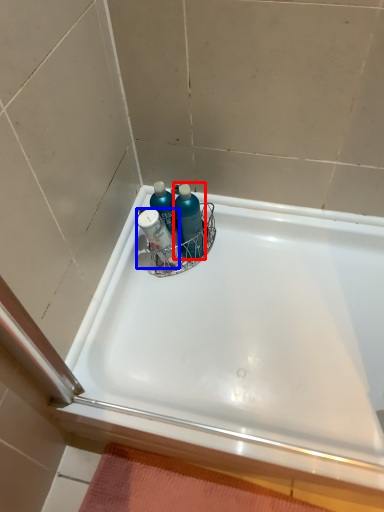
Question: Among these objects, which one is farthest to the camera, cleaning product (highlighted by a red box) or mouthwash (highlighted by a blue box)?

Choices:
 (A) cleaning product
 (B) mouthwash

Answer: (A)